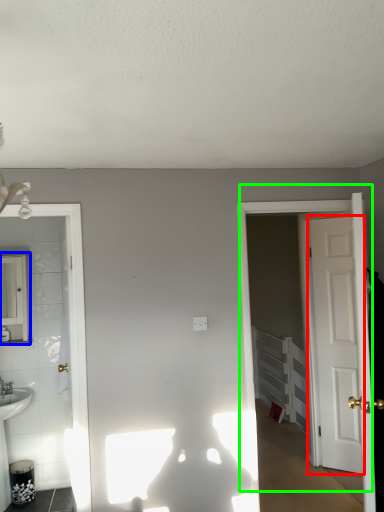
Question: Based on their relative distances, which object is farther from door (highlighted by a red box)? Choose from mirror (highlighted by a blue box) and door (highlighted by a green box).

Choices:
 (A) mirror
 (B) door

Answer: (A)